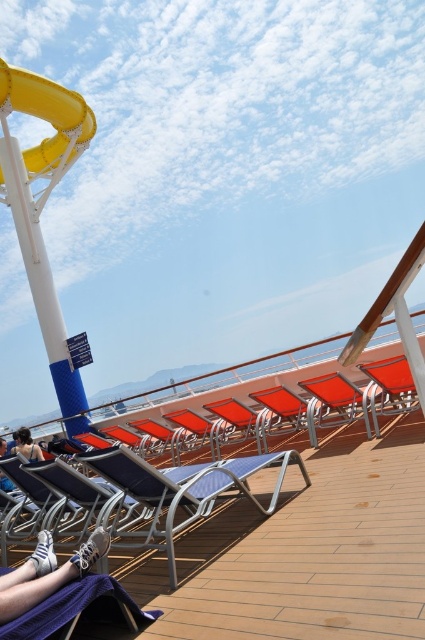
You are a passenger on the cruise ship and want to know if you can place your light blue denim shorts at lower left on top of the blue fabric beach chair at center. Based on their sizes, is this possible?

The blue fabric beach chair at center is much taller than the light blue denim shorts at lower left, so placing the shorts on top of the chair might be possible as the chair is taller, but the actual feasibility depends on the chair having a flat surface large enough to hold the shorts.

You are standing on the cruise ship deck and want to locate two specific points marked in the image. Which of the two points, point (x=176, y=531) or point (x=34, y=108), is nearer to you?

Point (x=176, y=531) is closer to the viewer than point (x=34, y=108).

You are a guest on the cruise ship and want to take a photo of the blue fabric beach chair at center and the yellow rubber slide at upper left. Which object is shorter?

The blue fabric beach chair at center is not as tall as the yellow rubber slide at upper left, so the blue fabric beach chair at center is shorter.